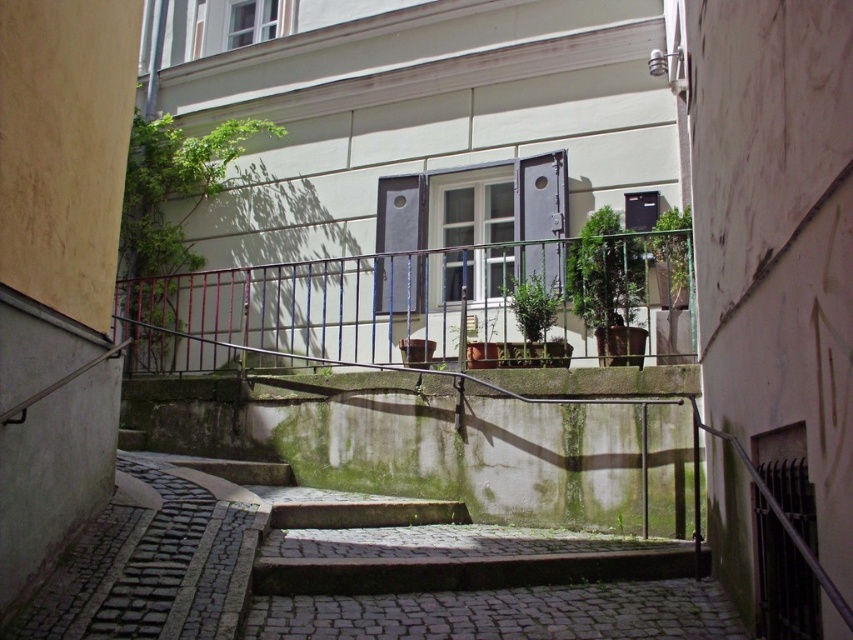
You are standing at the bottom of the cobblestone steps and see two green leafy plants. One is the green leafy plant at left and the other is the green leafy plant at upper center. Which plant is closer to you?

The green leafy plant at left is closer to you because it is further to the viewer than the green leafy plant at upper center.

You are a gardener tasked with watering plants in the alleyway. You have a watering can that can only reach plants within 1 meter. You are currently standing next to the green leafy plant at left. Can you water the green leafy plant at center without moving your position?

The green leafy plant at left is wider than the green leafy plant at center. Since the watering can can reach 1 meter, but the distance between the plants isn

You are a window cleaner standing at the bottom of the steps. You need to clean the window with dark wooden shutters. Which green leafy plant should you avoid stepping on to reach the window? The green leafy plant at left or the green leafy plant at upper center?

You should avoid stepping on the green leafy plant at left because it is much taller than the green leafy plant at upper center, so it might be in your way when reaching the window.